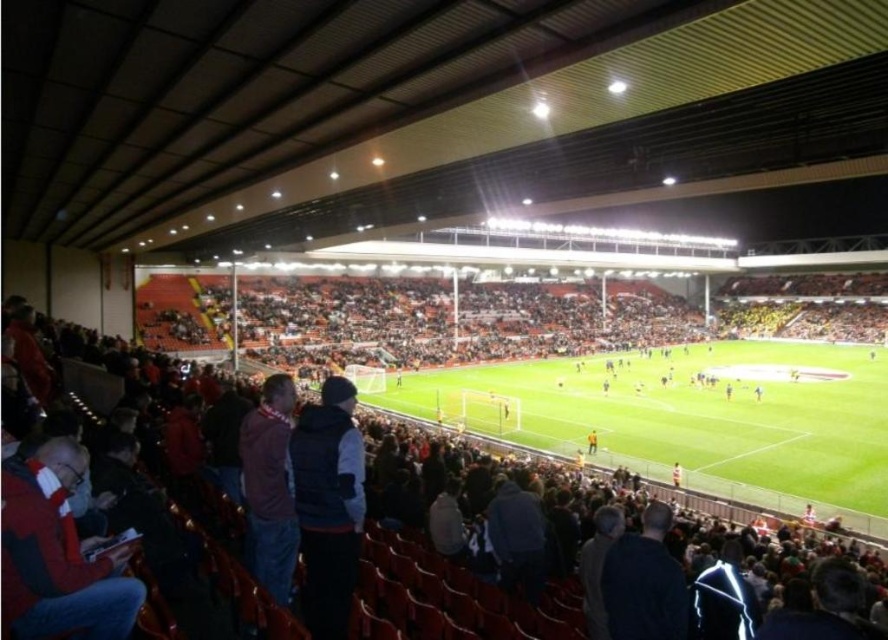
Can you confirm if red fleece scarf at lower left is positioned to the right of dark red sweater at lower left?

Incorrect, red fleece scarf at lower left is not on the right side of dark red sweater at lower left.

Between red fleece scarf at lower left and dark red sweater at lower left, which one appears on the right side from the viewer's perspective?

Positioned to the right is dark red sweater at lower left.

Describe the element at coordinates (58, 554) in the screenshot. I see `red fleece scarf at lower left` at that location.

Image resolution: width=888 pixels, height=640 pixels. I want to click on red fleece scarf at lower left, so click(x=58, y=554).

Is dark red seats at center further to the viewer compared to dark red sweater at lower left?

No.

Who is taller, dark red seats at center or dark red sweater at lower left?

With more height is dark red seats at center.

The image size is (888, 640). Identify the location of dark red seats at center. (442, 529).

Who is more distant from viewer, [599,371] or [38,557]?

The point [599,371] is more distant.

Who is positioned more to the left, green grass football field at center or red fleece scarf at lower left?

From the viewer's perspective, red fleece scarf at lower left appears more on the left side.

Is point (799, 493) positioned in front of point (32, 513)?

No, (799, 493) is further to viewer.

Identify the location of green grass football field at center. pos(692,419).